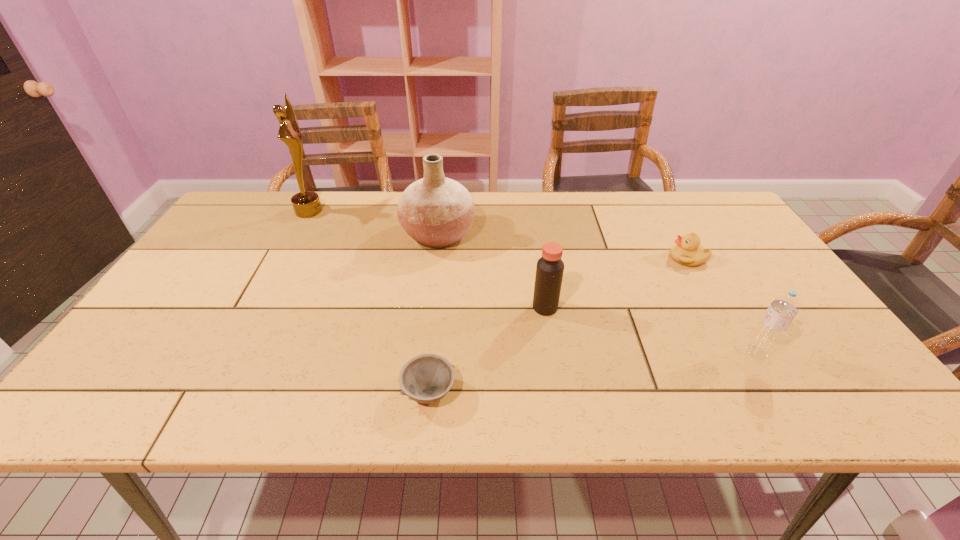
This screenshot has height=540, width=960. In order to click on vacant space located to pour from the handle of the fifth shortest object in this screenshot , I will do `click(555, 235)`.

You are a GUI agent. You are given a task and a screenshot of the screen. Output one action in this format:
    pyautogui.click(x=<x>, y=<y>)
    Task: Click on the free spot located on the back of the third object from right to left
    
    Given the screenshot: What is the action you would take?
    pyautogui.click(x=533, y=229)

Find the location of a particular element. The width and height of the screenshot is (960, 540). vacant space located on the front of the fifth farthest object is located at coordinates (788, 405).

Find the location of `vacant space located 0.050m on the front-facing side of the second shortest object`. vacant space located 0.050m on the front-facing side of the second shortest object is located at coordinates (652, 258).

Locate an element on the screen. The image size is (960, 540). vacant space located 0.300m on the front-facing side of the second shortest object is located at coordinates (564, 258).

You are a GUI agent. You are given a task and a screenshot of the screen. Output one action in this format:
    pyautogui.click(x=<x>, y=<y>)
    Task: Click on the vacant space located on the front-facing side of the second shortest object
    The height and width of the screenshot is (540, 960).
    Given the screenshot: What is the action you would take?
    pyautogui.click(x=582, y=258)

Find the location of `vacant space located on the left of the bowl`. vacant space located on the left of the bowl is located at coordinates (373, 392).

Find the location of a particular element. The width and height of the screenshot is (960, 540). award present at the far edge is located at coordinates (306, 204).

This screenshot has width=960, height=540. I want to click on pottery that is at the far edge, so click(436, 211).

I want to click on object that is at the near edge, so click(426, 378).